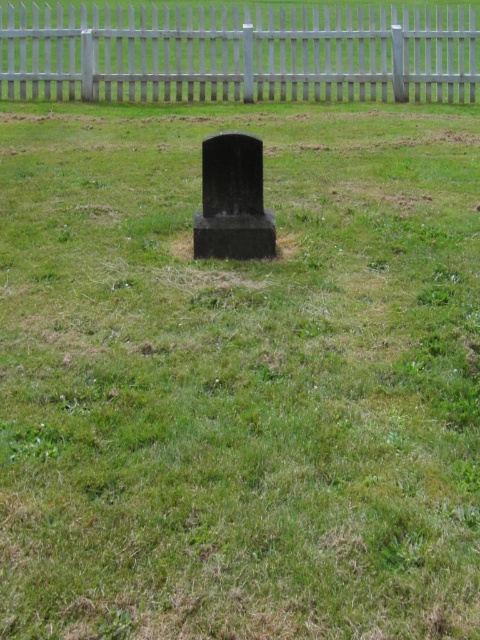
Who is higher up, white wooden fence at upper center or black polished stone gravestone at center?

white wooden fence at upper center is above.

Does white wooden fence at upper center have a lesser width compared to black polished stone gravestone at center?

→ Yes.

Measure the distance between point (434, 76) and camera.

Point (434, 76) and camera are 13.43 meters apart from each other.

Identify the location of white wooden fence at upper center. (238, 52).